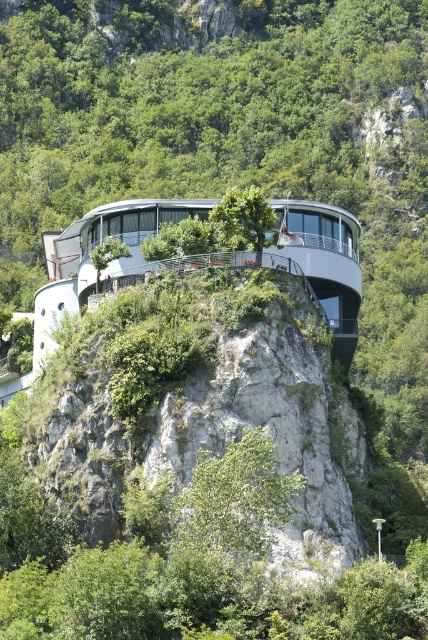
You are standing at the edge of the white stone cliff at center and want to reach the green leafy tree at center. Which direction should you move to get closer to the tree?

You should move to the left because the white stone cliff at center is to the right of the green leafy tree at center, so moving left will bring you closer to the tree.

You are a landscape architect evaluating the site for a new observation deck. The deck must be placed on the white stone cliff at center while ensuring it doesn not block the view of the green leafy tree at center. Given their sizes, can the deck be built without obscuring the tree?

The white stone cliff at center is larger in size than the green leafy tree at center, so it is possible to position the deck on the cliff in a way that avoids blocking the view of the tree by utilizing the larger area of the cliff to place the deck away from the tree.